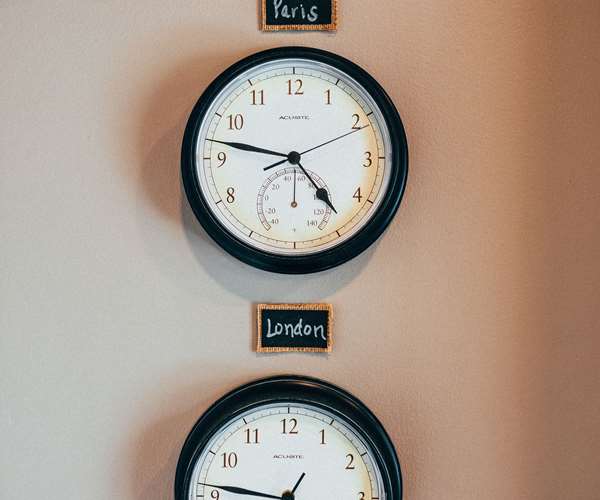
Find the location of a particular element. This screenshot has height=500, width=600. wall is located at coordinates (123, 360).